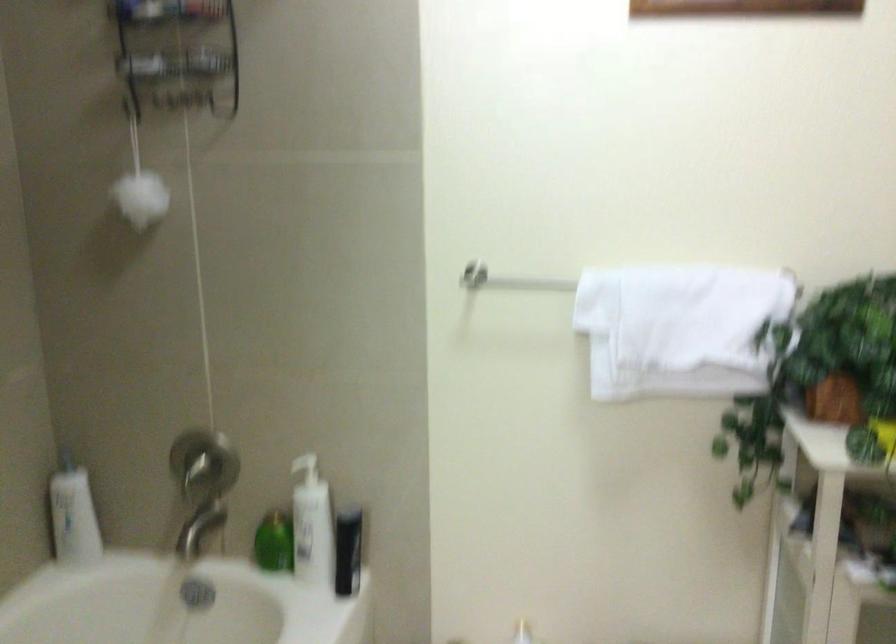
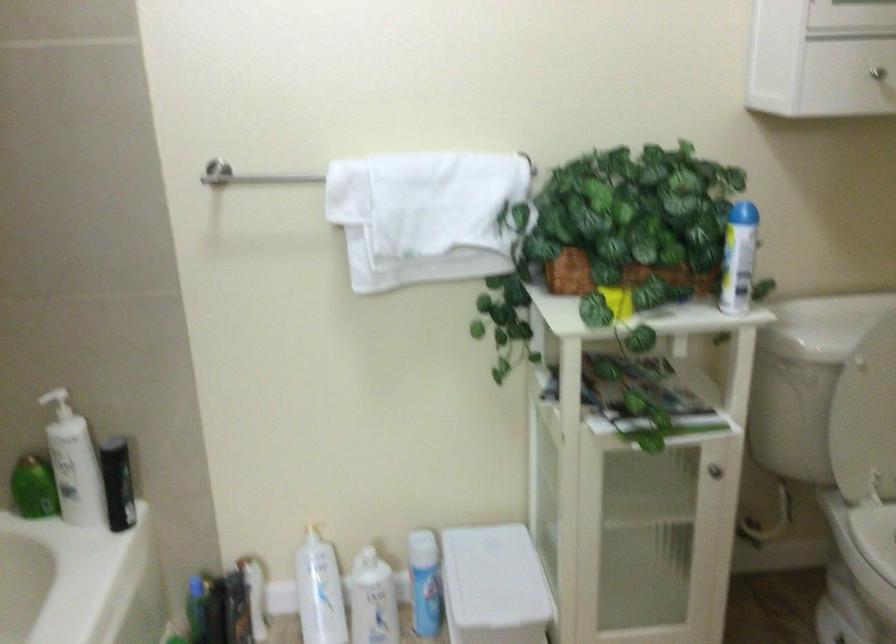
Locate, in the second image, the point that corresponds to the point at 345,554 in the first image.

(117, 483)